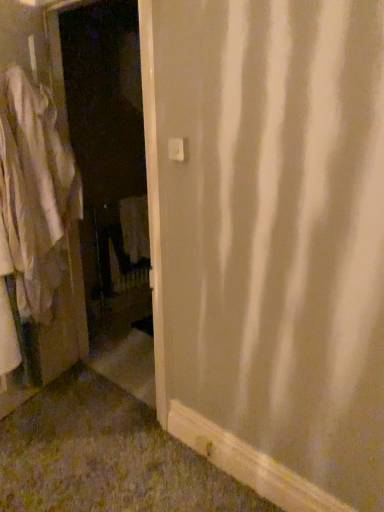
Question: Can you confirm if white matte screen door at left is wider than white cotton shirt at left?

Choices:
 (A) yes
 (B) no

Answer: (B)

Question: Can you confirm if white matte screen door at left is taller than white cotton shirt at left?

Choices:
 (A) no
 (B) yes

Answer: (B)

Question: Is white matte screen door at left placed right next to white cotton shirt at left?

Choices:
 (A) yes
 (B) no

Answer: (B)

Question: Is white matte screen door at left in front of white cotton shirt at left?

Choices:
 (A) no
 (B) yes

Answer: (B)

Question: Can we say white matte screen door at left lies outside white cotton shirt at left?

Choices:
 (A) yes
 (B) no

Answer: (A)

Question: Is white matte screen door at left turned away from white cotton shirt at left?

Choices:
 (A) yes
 (B) no

Answer: (A)

Question: Is white cotton shirt at left oriented away from white matte screen door at left?

Choices:
 (A) no
 (B) yes

Answer: (A)

Question: Is white cotton shirt at left to the right of white matte screen door at left from the viewer's perspective?

Choices:
 (A) yes
 (B) no

Answer: (B)

Question: Can you confirm if white cotton shirt at left is shorter than white matte screen door at left?

Choices:
 (A) yes
 (B) no

Answer: (A)

Question: From the image's perspective, does white cotton shirt at left appear lower than white matte screen door at left?

Choices:
 (A) yes
 (B) no

Answer: (A)

Question: From the image's perspective, does white cotton shirt at left appear higher than white matte screen door at left?

Choices:
 (A) yes
 (B) no

Answer: (B)

Question: Is white cotton shirt at left positioned behind white matte screen door at left?

Choices:
 (A) no
 (B) yes

Answer: (B)

Question: Looking at their shapes, would you say white cotton shirt at left is wider or thinner than white matte screen door at left?

Choices:
 (A) wide
 (B) thin

Answer: (A)